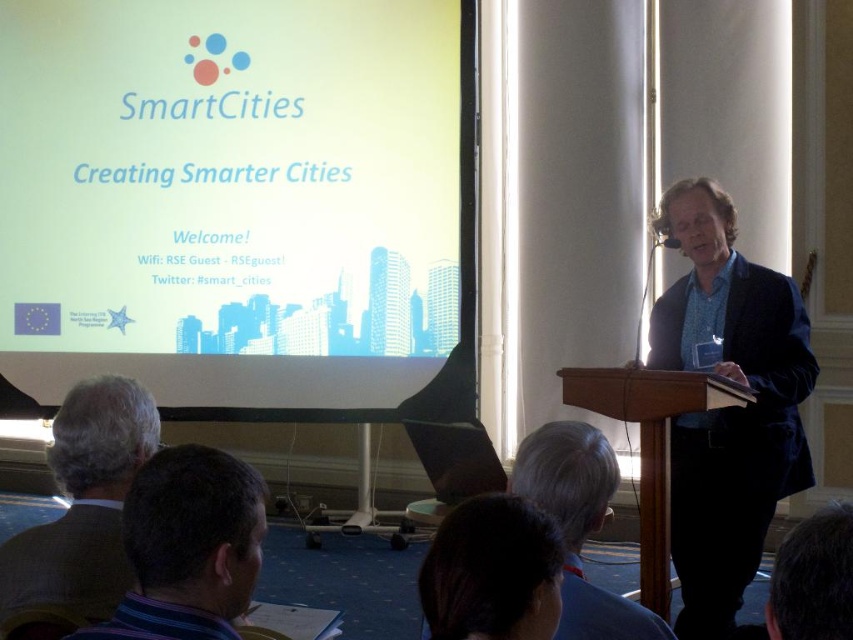
Question: Can you confirm if dark blue striped shirt at lower left is positioned above gray hair at upper center?

Choices:
 (A) yes
 (B) no

Answer: (A)

Question: Can you confirm if white matte projection screen at upper center is bigger than gray hair at upper center?

Choices:
 (A) yes
 (B) no

Answer: (A)

Question: Which object is farther from the camera taking this photo?

Choices:
 (A) white matte projection screen at upper center
 (B) dark blue striped shirt at lower left
 (C) gray hair at upper center
 (D) wooden podium at center

Answer: (A)

Question: Among these points, which one is farthest from the camera?

Choices:
 (A) (567, 376)
 (B) (80, 499)

Answer: (A)

Question: Which of the following is the farthest from the observer?

Choices:
 (A) gray wool sweater at lower left
 (B) white matte projection screen at upper center

Answer: (B)

Question: Can you confirm if dark blue striped shirt at lower left is positioned to the left of gray hair at upper center?

Choices:
 (A) yes
 (B) no

Answer: (A)